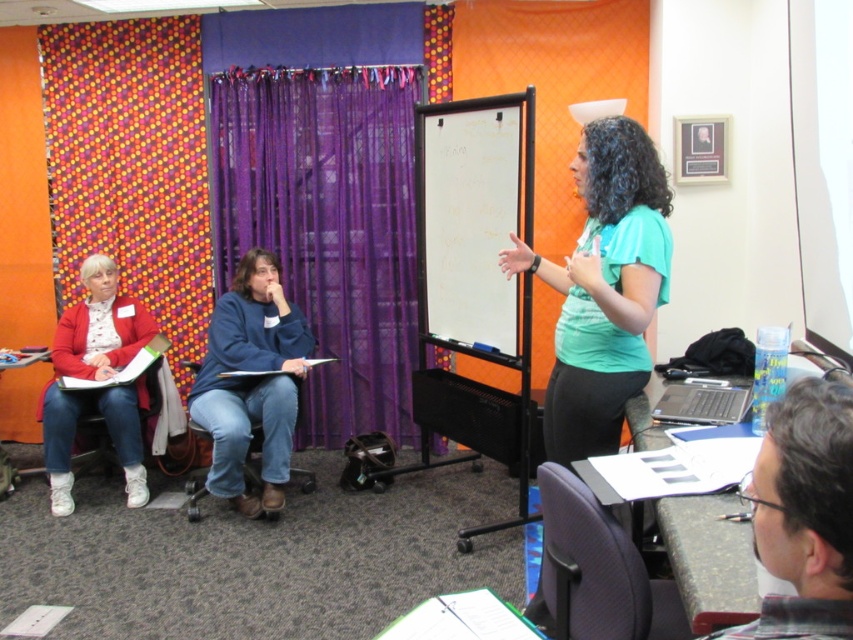
You are a person who is 1.7 meters tall standing in the classroom. You want to move from the orange dotted fabric at left to the teal matte shirt at center. Can you walk straight between them without bending or moving any objects?

The distance between the orange dotted fabric at left and the teal matte shirt at center is 2.65 meters, so yes, you can walk straight between them without bending or moving any objects since the space is more than sufficient for a person of 1.7 meters height.